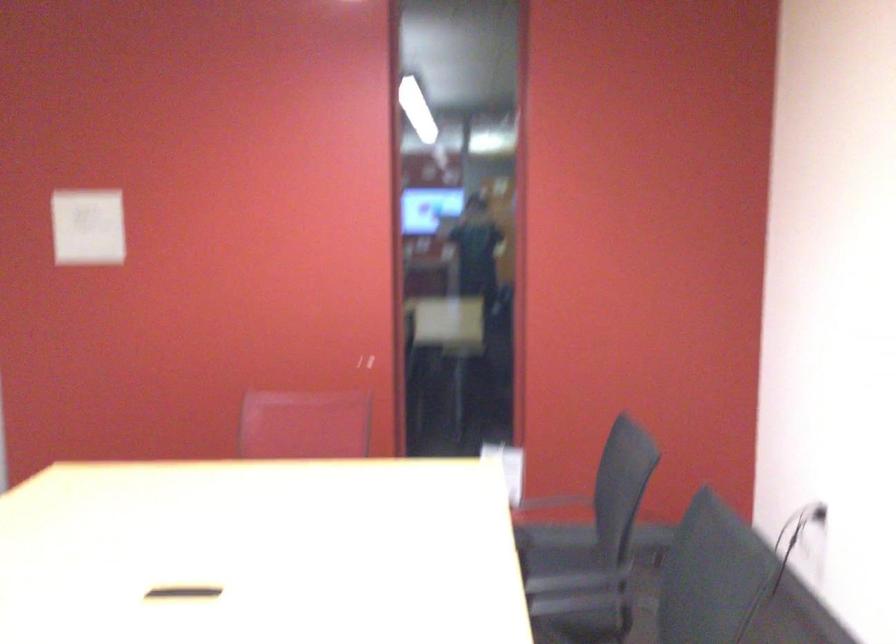
The first image is from the beginning of the video and the second image is from the end. How did the camera likely rotate when shooting the video?

The camera's rotation is toward right-down.